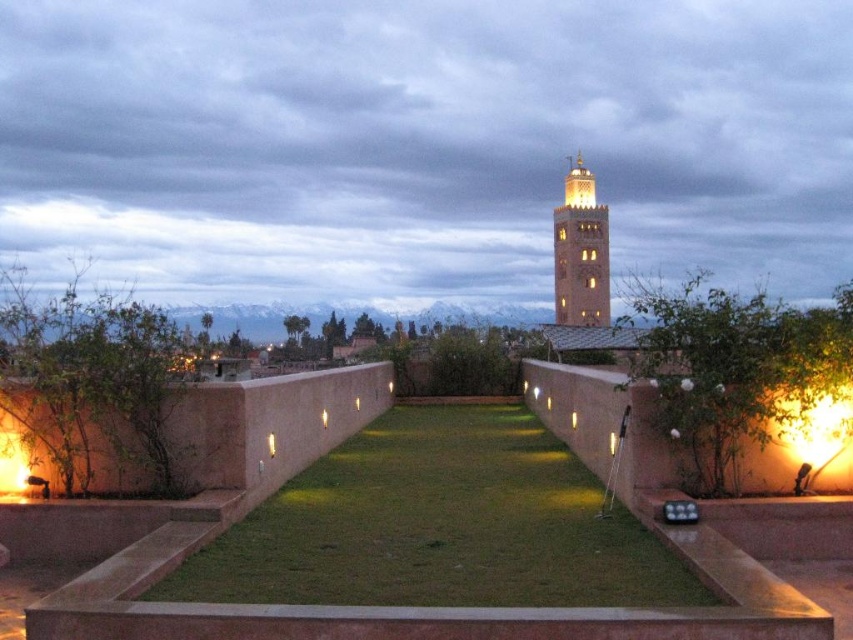
You are planning to set up a small garden party on the rooftop. Considering the space occupied by the green grass at center and the light brown stone minaret at upper center, which area would be more suitable for placing a large dining table?

The light brown stone minaret at upper center occupies more space than the green grass at center, so the green grass at center would be more suitable for placing a large dining table since it has less space available. Wait, that seems contradictory. Let me check the description again. The Objects Description says the green grass occupies less space than the minaret. So the minaret takes up more area, meaning the grass area is smaller. Therefore, if you want a large table, you need a larger space. Hmm, maybe

You are standing on the rooftop garden and want to walk from the green grass at center to the light brown stone minaret at upper center. Which direction should you move to reach the minaret?

To reach the light brown stone minaret at upper center from the green grass at center, you should move to the right since the green grass at center is located to the left of the minaret.

You are standing on the rooftop garden and want to place a small potted plant exactly where the green grass at center is located. According to the coordinates provided, where should you place the potted plant?

You should place the potted plant at the coordinates point (439, 525) where the green grass at center is located.